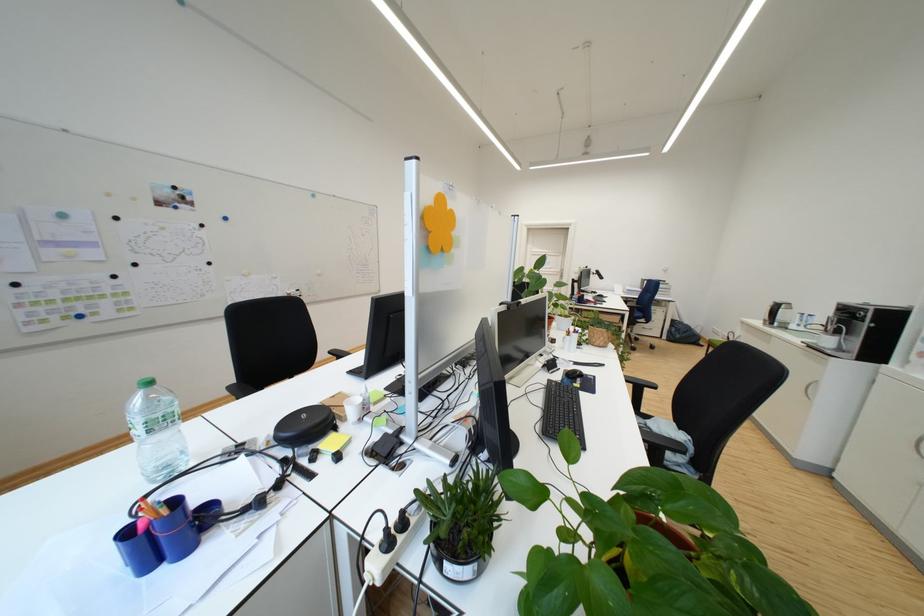
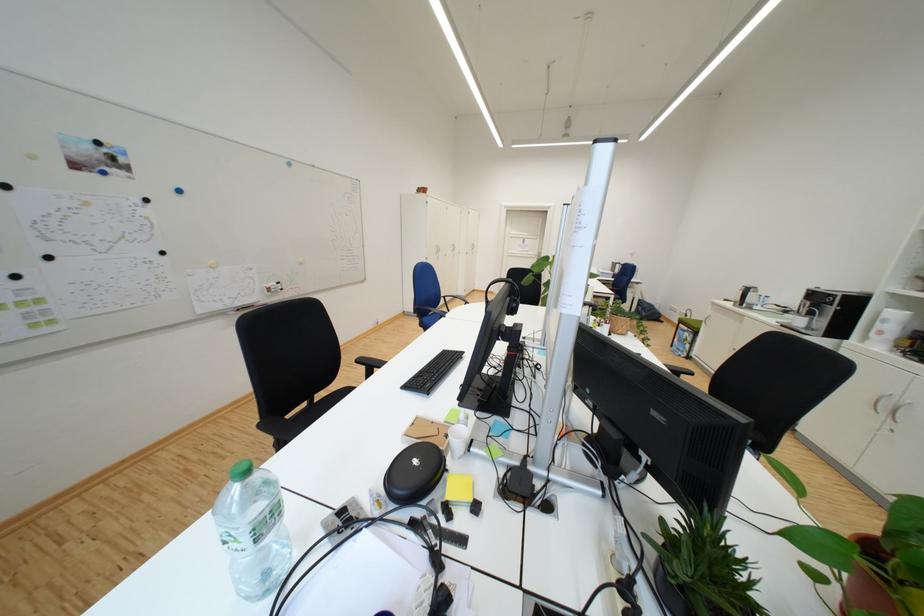
In a continuous first-person perspective shot, in which direction is the camera moving?

The movement direction of the cameraman is left, forward.